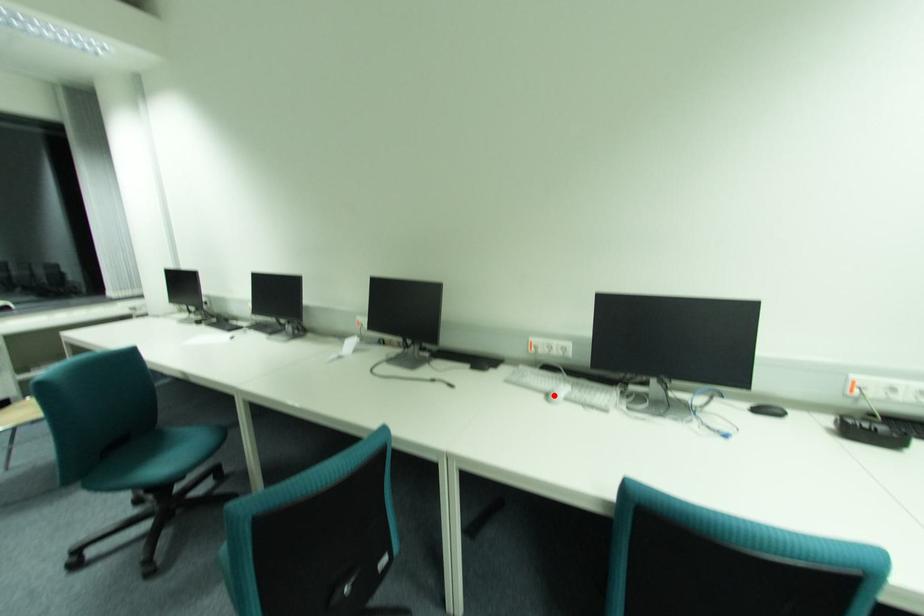
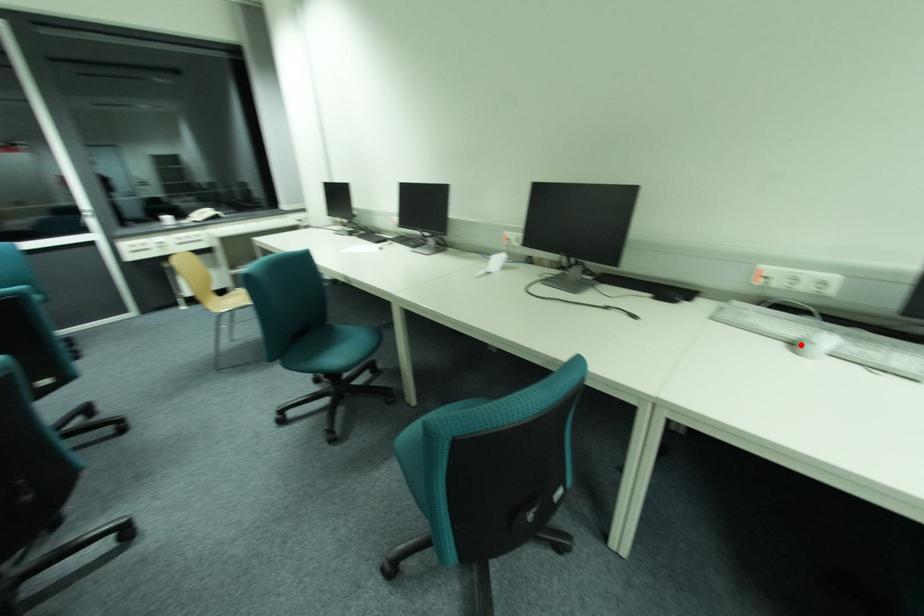
I am providing you with two images of the same scene from different viewpoints. A red point is marked on the first image and another point is marked on the second image. Do the highlighted points in image1 and image2 indicate the same real-world spot?

Yes